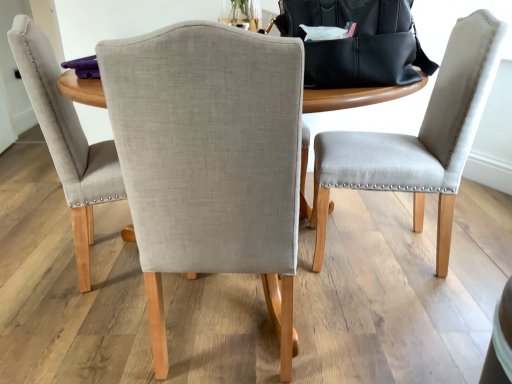
Question: Considering the positions of point (314, 64) and point (172, 51), is point (314, 64) closer or farther from the camera than point (172, 51)?

Choices:
 (A) closer
 (B) farther

Answer: (B)

Question: Considering the positions of black leather messenger bag at upper center and light gray fabric chair at center, the second chair in the right-to-left sequence, in the image, is black leather messenger bag at upper center bigger or smaller than light gray fabric chair at center, the second chair in the right-to-left sequence,?

Choices:
 (A) small
 (B) big

Answer: (A)

Question: Which of these objects is positioned closest to the light gray fabric chair at center, placed as the second chair when sorted from left to right?

Choices:
 (A) black leather messenger bag at upper center
 (B) light gray fabric chair at center, arranged as the 3th chair when viewed from the right
 (C) matte gray chair at right, which ranks as the third chair in left-to-right order

Answer: (A)

Question: Estimate the real-world distances between objects in this image. Which object is closer to the matte gray chair at right, which ranks as the third chair in left-to-right order?

Choices:
 (A) black leather messenger bag at upper center
 (B) light gray fabric chair at center, placed as the second chair when sorted from left to right
 (C) light gray fabric chair at center, arranged as the 3th chair when viewed from the right

Answer: (A)